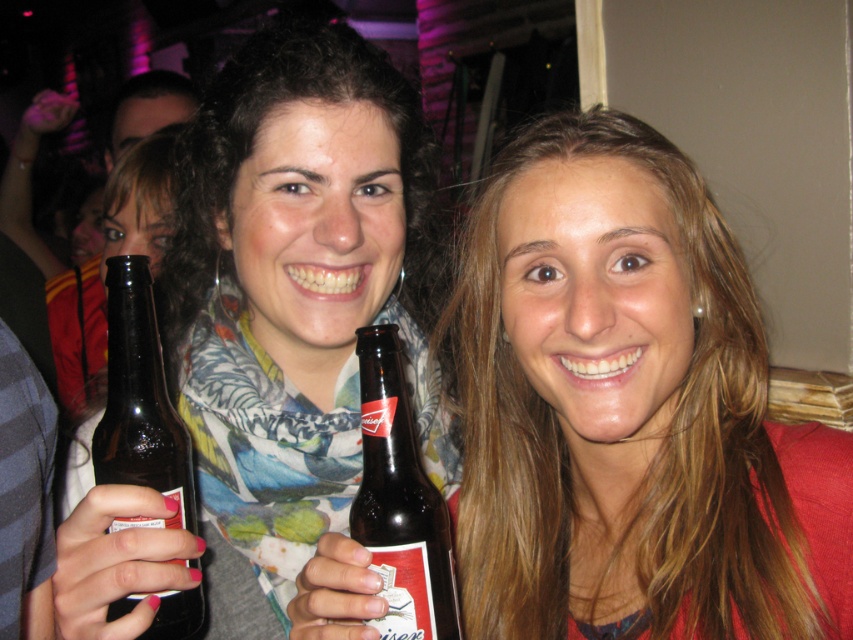
Who is lower down, matte black bottle at left or brown glass bottle at bottle left?

brown glass bottle at bottle left is below.

Which is behind, point (331, 48) or point (160, 376)?

Positioned behind is point (331, 48).

Between point (299, 442) and point (108, 470), which one is positioned in front?

Point (108, 470)

Locate an element on the screen. matte black bottle at left is located at coordinates (300, 284).

In the scene shown: Can you confirm if matte brown bottle at center is taller than brown glass beer bottle at center?

Correct, matte brown bottle at center is much taller as brown glass beer bottle at center.

Does matte brown bottle at center have a lesser height compared to brown glass beer bottle at center?

No.

Who is more forward, (x=734, y=445) or (x=425, y=481)?

Point (x=425, y=481)

The height and width of the screenshot is (640, 853). I want to click on matte brown bottle at center, so click(x=627, y=410).

Who is positioned more to the right, matte brown bottle at center or brown glass bottle at bottle left?

matte brown bottle at center

Does matte brown bottle at center have a smaller size compared to brown glass bottle at bottle left?

No, matte brown bottle at center is not smaller than brown glass bottle at bottle left.

Which is behind, point (554, 497) or point (128, 257)?

The point (554, 497) is more distant.

I want to click on matte brown bottle at center, so click(x=627, y=410).